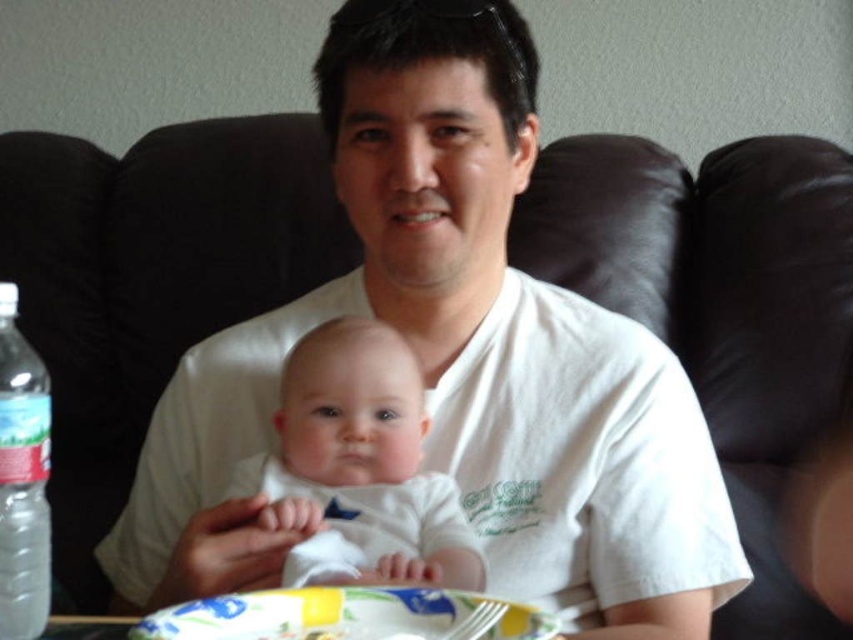
Is point (396, 387) less distant than point (44, 461)?

No.

In the scene shown: Does white soft fabric baby at center come behind clear plastic bottle at left?

Yes.

Which is in front, point (386, 540) or point (7, 538)?

Point (7, 538)

Where is `white soft fabric baby at center`? Image resolution: width=853 pixels, height=640 pixels. white soft fabric baby at center is located at coordinates (360, 467).

Between yellow paper plate at lower center and clear plastic bottle at left, which one is positioned lower?

yellow paper plate at lower center is lower down.

What do you see at coordinates (347, 616) in the screenshot? I see `yellow paper plate at lower center` at bounding box center [347, 616].

At what (x,y) coordinates should I click in order to perform the action: click on yellow paper plate at lower center. Please return your answer as a coordinate pair (x, y). This screenshot has height=640, width=853. Looking at the image, I should click on (347, 616).

Can you confirm if white soft fabric baby at center is positioned to the right of yellow paper plate at lower center?

In fact, white soft fabric baby at center is to the left of yellow paper plate at lower center.

Which is in front, point (300, 477) or point (252, 604)?

Point (252, 604) is more forward.

Identify the location of white soft fabric baby at center. (360, 467).